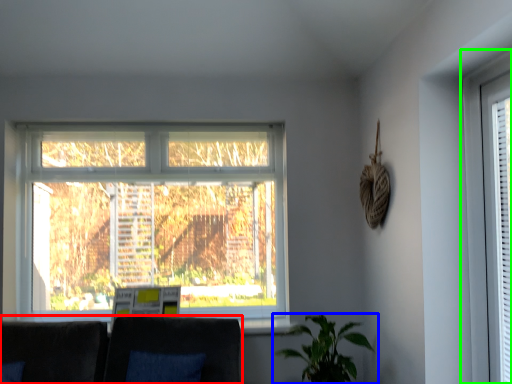
Question: Which object is positioned closest to couch (highlighted by a red box)? Select from houseplant (highlighted by a blue box) and window (highlighted by a green box).

Choices:
 (A) houseplant
 (B) window

Answer: (A)